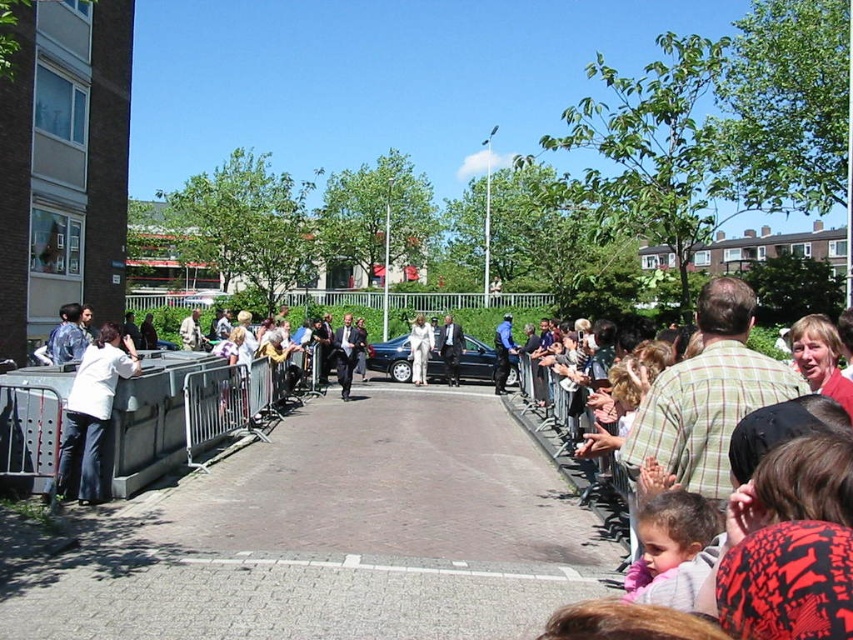
Question: Which point is closer to the camera?

Choices:
 (A) dark suit at center
 (B) white fabric jacket at left
 (C) white satin suit at center
 (D) blue uniformed officer at center

Answer: (B)

Question: Estimate the real-world distances between objects in this image. Which object is farther from the white satin suit at center?

Choices:
 (A) silver metallic barrier at left
 (B) white fabric jacket at left
 (C) blue uniformed officer at center

Answer: (B)

Question: Which object is positioned closest to the gray concrete pavement at center?

Choices:
 (A) blue uniformed officer at center
 (B) dark suit at center
 (C) silver metallic barrier at left
 (D) white satin suit at center

Answer: (C)

Question: Is gray concrete pavement at center wider than white fabric jacket at left?

Choices:
 (A) yes
 (B) no

Answer: (A)

Question: Can you confirm if gray concrete pavement at center is bigger than light brown plaid shirt at right?

Choices:
 (A) no
 (B) yes

Answer: (B)

Question: Is gray concrete pavement at center above white fabric jacket at left?

Choices:
 (A) no
 (B) yes

Answer: (A)